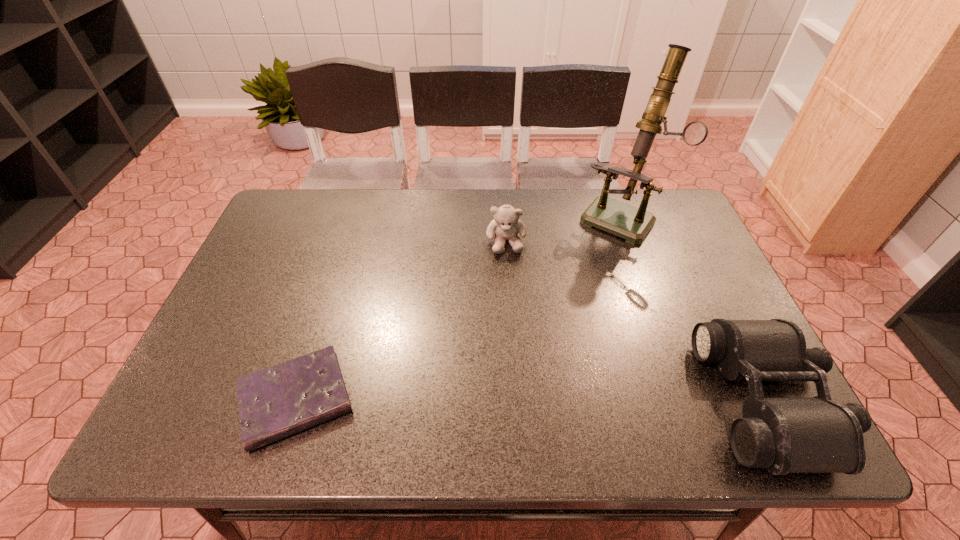
Identify the location of vacant space that satisfies the following two spatial constraints: 1. on the back side of the shortest object; 2. on the right side of the teddy bear. (347, 241).

Image resolution: width=960 pixels, height=540 pixels. I want to click on blank space that satisfies the following two spatial constraints: 1. on the front side of the second shortest object; 2. through the eyepieces of the diary, so click(296, 400).

Identify the location of vacant region that satisfies the following two spatial constraints: 1. on the back side of the third shortest object; 2. on the right side of the leftmost object. (347, 241).

Locate an element on the screen. The image size is (960, 540). blank area in the image that satisfies the following two spatial constraints: 1. on the front side of the shortest object; 2. through the eyepieces of the second shortest object is located at coordinates (296, 400).

This screenshot has height=540, width=960. In order to click on vacant area that satisfies the following two spatial constraints: 1. on the front side of the binoculars; 2. through the eyepieces of the second object from left to right in this screenshot , I will do `click(516, 400)`.